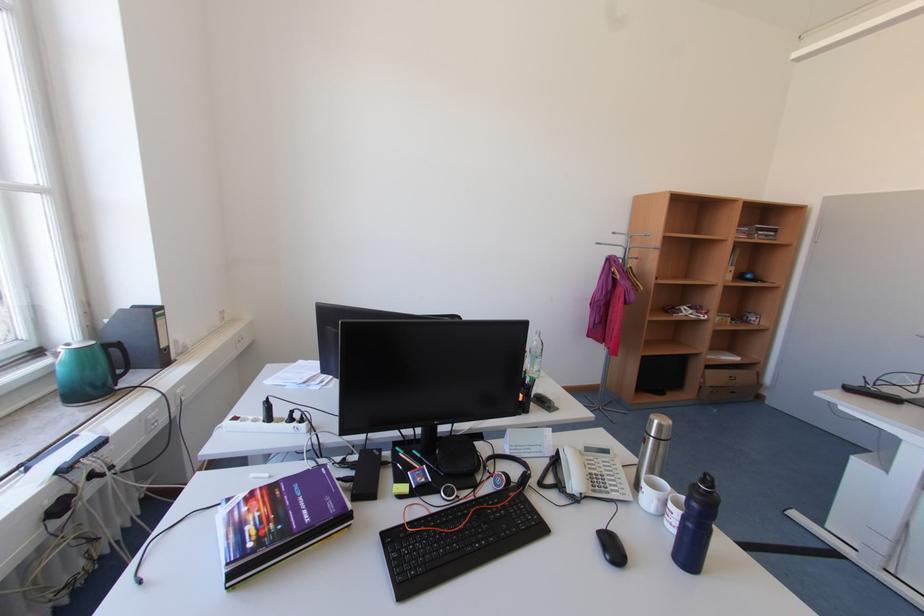
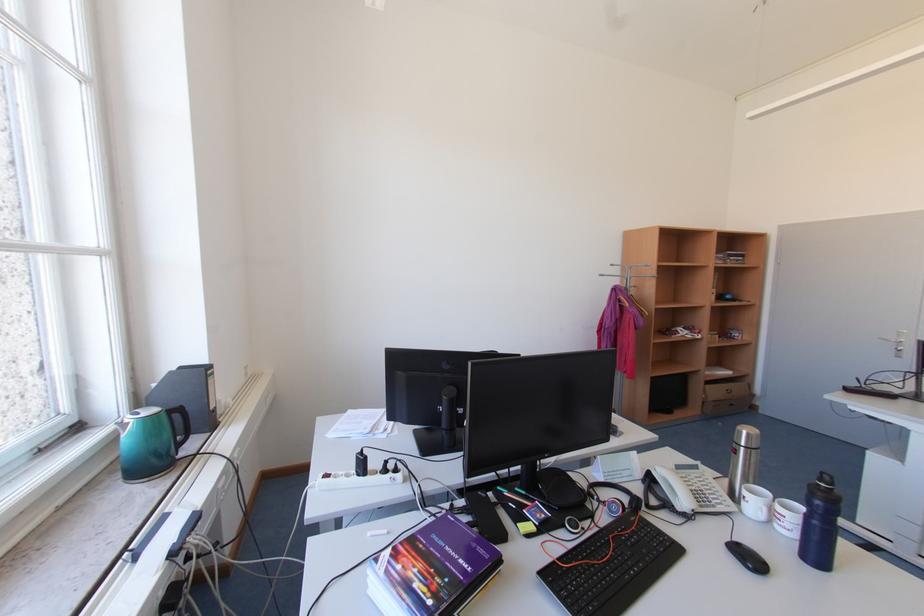
Where in the second image is the point corresponding to pixel 254 525 from the first image?

(419, 583)